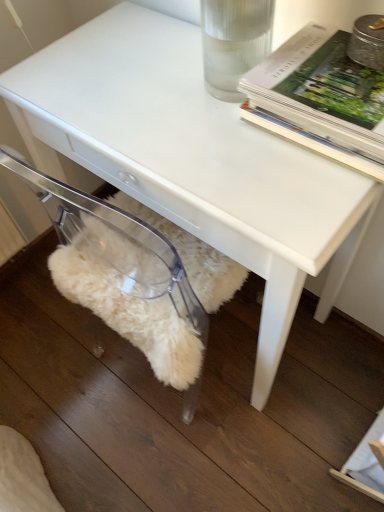
Where is `transparent acrylic swivel chair at lower left`? The width and height of the screenshot is (384, 512). transparent acrylic swivel chair at lower left is located at coordinates (136, 274).

Image resolution: width=384 pixels, height=512 pixels. What do you see at coordinates (136, 274) in the screenshot?
I see `transparent acrylic swivel chair at lower left` at bounding box center [136, 274].

In order to face hardcover book at upper right, should I rotate leftwards or rightwards?

To face it directly, rotate right by 20.282 degrees.

Image resolution: width=384 pixels, height=512 pixels. What do you see at coordinates (320, 99) in the screenshot? I see `hardcover book at upper right` at bounding box center [320, 99].

I want to click on hardcover book at upper right, so click(x=320, y=99).

Find the location of a particular element. transparent acrylic swivel chair at lower left is located at coordinates (136, 274).

Can you confirm if transparent acrylic swivel chair at lower left is positioned to the left of hardcover book at upper right?

Yes, transparent acrylic swivel chair at lower left is to the left of hardcover book at upper right.

Does transparent acrylic swivel chair at lower left lie in front of hardcover book at upper right?

No, it is not.

Is point (194, 270) positioned before point (364, 138)?

No, it is not.

From the image's perspective, is transparent acrylic swivel chair at lower left located above or below hardcover book at upper right?

From the image's perspective, transparent acrylic swivel chair at lower left appears below hardcover book at upper right.

From a real-world perspective, who is located higher, transparent acrylic swivel chair at lower left or hardcover book at upper right?

hardcover book at upper right.

Which object is wider, transparent acrylic swivel chair at lower left or hardcover book at upper right?

With larger width is transparent acrylic swivel chair at lower left.

From the picture: From their relative heights in the image, would you say transparent acrylic swivel chair at lower left is taller or shorter than hardcover book at upper right?

transparent acrylic swivel chair at lower left is taller than hardcover book at upper right.

Can you confirm if transparent acrylic swivel chair at lower left is smaller than hardcover book at upper right?

No.

Is transparent acrylic swivel chair at lower left positioned beyond the bounds of hardcover book at upper right?

transparent acrylic swivel chair at lower left is positioned outside hardcover book at upper right.

Is transparent acrylic swivel chair at lower left far away from hardcover book at upper right?

No, there isn't a large distance between transparent acrylic swivel chair at lower left and hardcover book at upper right.

Is transparent acrylic swivel chair at lower left oriented towards hardcover book at upper right?

No, transparent acrylic swivel chair at lower left is not turned towards hardcover book at upper right.

What's the angular difference between transparent acrylic swivel chair at lower left and hardcover book at upper right's facing directions?

There is a 0.703-degree angle between the facing directions of transparent acrylic swivel chair at lower left and hardcover book at upper right.

Find the location of a particular element. swivel chair on the left of hardcover book at upper right is located at coordinates (136, 274).

Considering the positions of objects hardcover book at upper right and transparent acrylic swivel chair at lower left in the image provided, who is more to the left, hardcover book at upper right or transparent acrylic swivel chair at lower left?

transparent acrylic swivel chair at lower left.

Which object is further away from the camera, hardcover book at upper right or transparent acrylic swivel chair at lower left?

transparent acrylic swivel chair at lower left is behind.

Is point (300, 53) positioned behind point (175, 304)?

No, (300, 53) is in front of (175, 304).

From the image's perspective, which is above, hardcover book at upper right or transparent acrylic swivel chair at lower left?

From the image's view, hardcover book at upper right is above.

From a real-world perspective, is hardcover book at upper right positioned above or below transparent acrylic swivel chair at lower left?

hardcover book at upper right is above transparent acrylic swivel chair at lower left.

In the scene shown: Considering the sizes of objects hardcover book at upper right and transparent acrylic swivel chair at lower left in the image provided, who is thinner, hardcover book at upper right or transparent acrylic swivel chair at lower left?

hardcover book at upper right.

Which of these two, hardcover book at upper right or transparent acrylic swivel chair at lower left, stands taller?

With more height is transparent acrylic swivel chair at lower left.

Can you confirm if hardcover book at upper right is smaller than transparent acrylic swivel chair at lower left?

Indeed, hardcover book at upper right has a smaller size compared to transparent acrylic swivel chair at lower left.

Would you say transparent acrylic swivel chair at lower left is part of hardcover book at upper right's contents?

No.

Is hardcover book at upper right directly adjacent to transparent acrylic swivel chair at lower left?

No, hardcover book at upper right is not making contact with transparent acrylic swivel chair at lower left.

Is hardcover book at upper right looking in the opposite direction of transparent acrylic swivel chair at lower left?

No, transparent acrylic swivel chair at lower left is not at the back of hardcover book at upper right.

How many degrees apart are the facing directions of hardcover book at upper right and transparent acrylic swivel chair at lower left?

There is a 0.703-degree angle between the facing directions of hardcover book at upper right and transparent acrylic swivel chair at lower left.

Identify the location of swivel chair behind the hardcover book at upper right. (136, 274).

Image resolution: width=384 pixels, height=512 pixels. In order to click on book above the transparent acrylic swivel chair at lower left (from the image's perspective) in this screenshot , I will do `click(320, 99)`.

Where is `swivel chair below the hardcover book at upper right (from a real-world perspective)`? The height and width of the screenshot is (512, 384). swivel chair below the hardcover book at upper right (from a real-world perspective) is located at coordinates (136, 274).